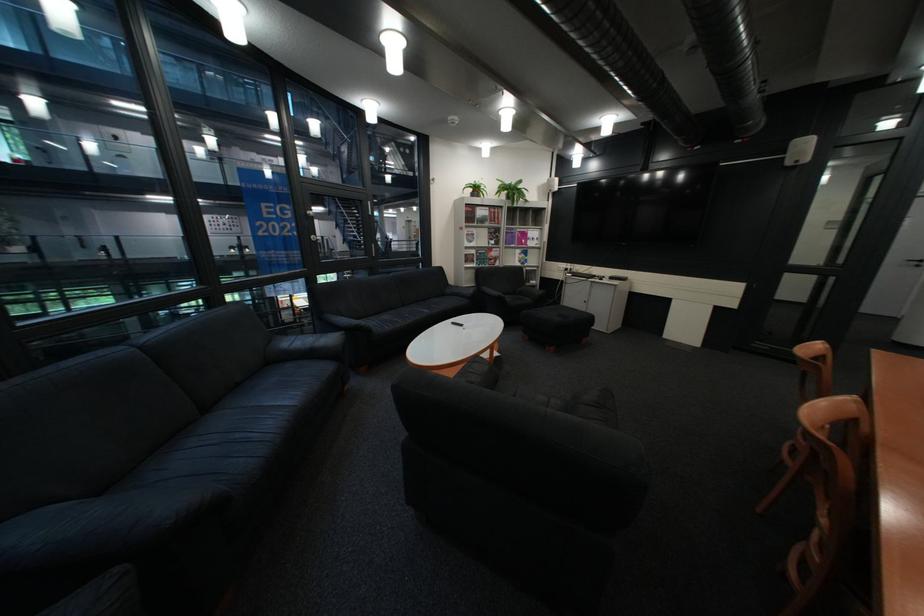
What do you see at coordinates (913, 262) in the screenshot?
I see `a door handle` at bounding box center [913, 262].